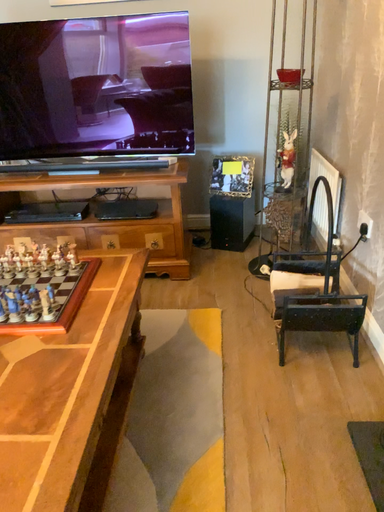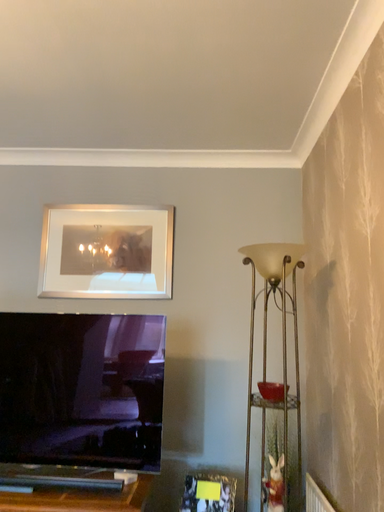
Question: How did the camera likely rotate when shooting the video?

Choices:
 (A) rotated upward
 (B) rotated downward

Answer: (A)